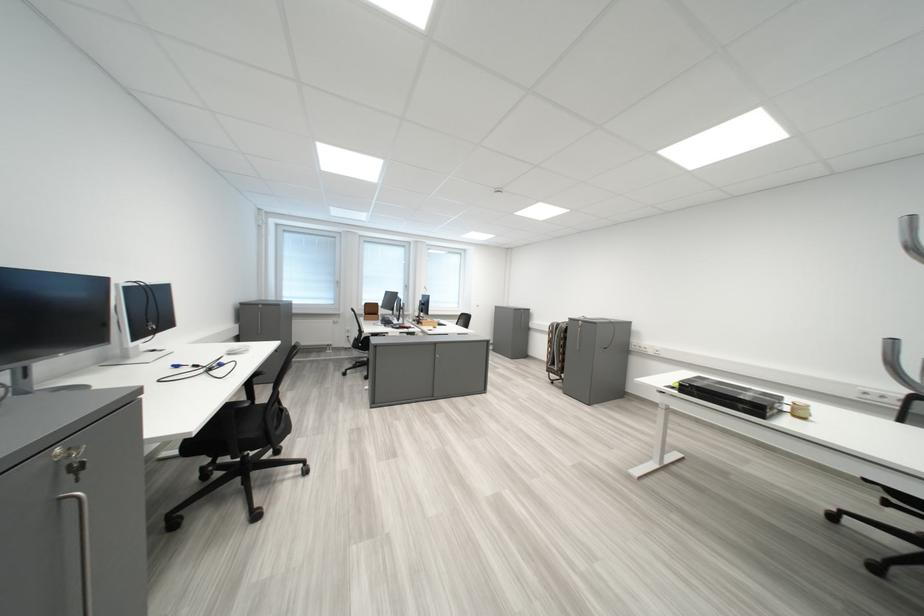
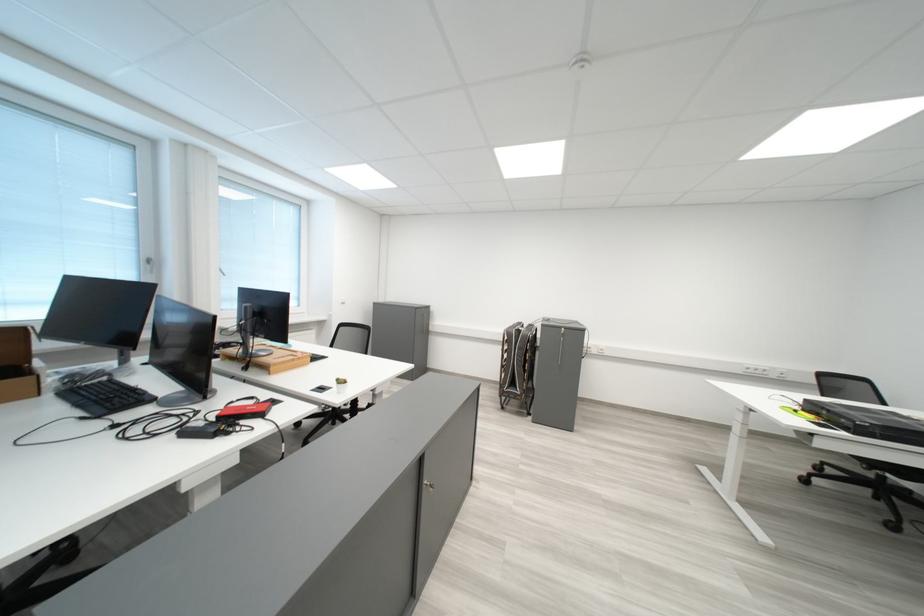
Where in the second image is the point corresponding to point 407,330 from the first image?

(200, 436)